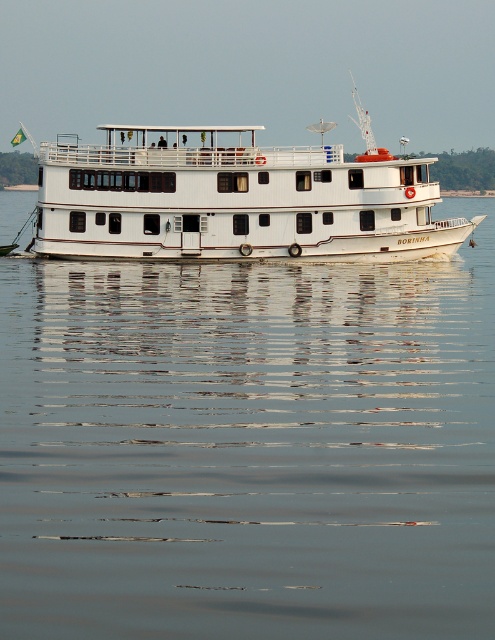
Question: Which object appears closest to the camera in this image?

Choices:
 (A) smooth white water at center
 (B) white matte boat at center

Answer: (A)

Question: Is smooth white water at center thinner than white matte boat at center?

Choices:
 (A) yes
 (B) no

Answer: (A)

Question: Is smooth white water at center thinner than white matte boat at center?

Choices:
 (A) yes
 (B) no

Answer: (A)

Question: Which object appears farthest from the camera in this image?

Choices:
 (A) white matte boat at center
 (B) smooth white water at center

Answer: (A)

Question: Is smooth white water at center above white matte boat at center?

Choices:
 (A) no
 (B) yes

Answer: (A)